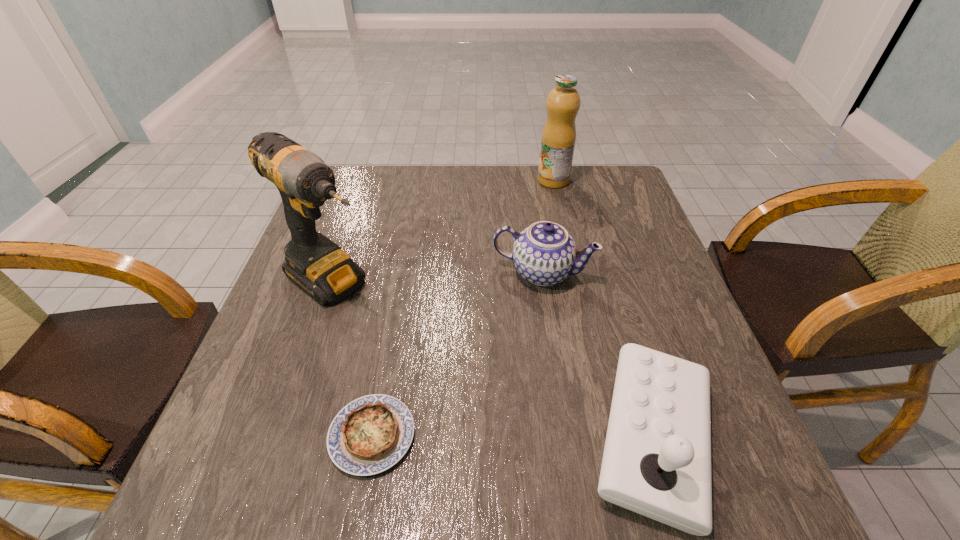
At what (x,y) coordinates should I click in order to perform the action: click on free space that satisfies the following two spatial constraints: 1. on the back side of the drill; 2. on the right side of the chinaware. Please return your answer as a coordinate pair (x, y). This screenshot has height=540, width=960. Looking at the image, I should click on (336, 273).